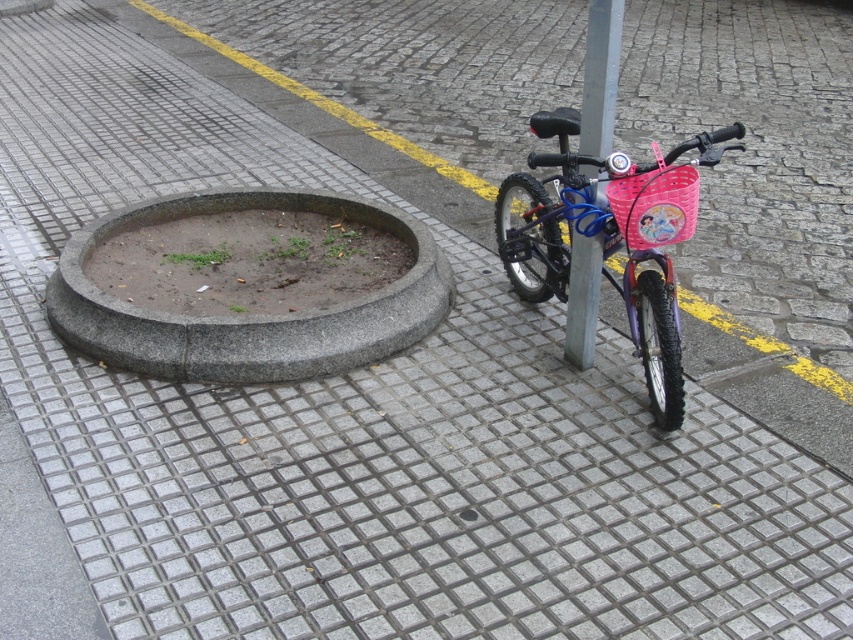
You are a delivery person trying to park your van next to the gray concrete curb at center and the metallic gray pole at center. Which one should you avoid to prevent damaging your van?

You should avoid the gray concrete curb at center because it might be wider than the metallic gray pole at center, so it is more likely to cause damage to the van if hit.